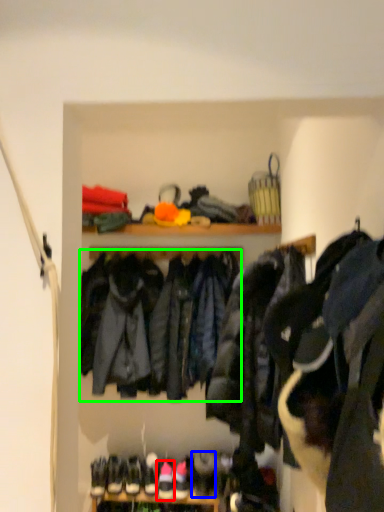
Question: Considering the real-world distances, which object is closest to footwear (highlighted by a red box)? shoe (highlighted by a blue box) or jacket (highlighted by a green box).

Choices:
 (A) shoe
 (B) jacket

Answer: (A)